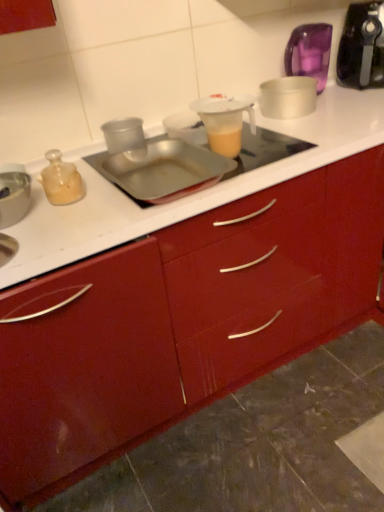
Question: From the image's perspective, relative to metallic silver bowl at left, which ranks as the 1th appliance in front-to-back order, is translucent plastic pitcher at center above or below?

Choices:
 (A) above
 (B) below

Answer: (A)

Question: Is translucent plastic pitcher at center bigger or smaller than metallic silver bowl at left, which is the 1th appliance in left-to-right order?

Choices:
 (A) big
 (B) small

Answer: (B)

Question: Considering the real-world distances, which object is farthest from the black plastic blender at upper right?

Choices:
 (A) transparent plastic cup at center, which is the third appliance in right-to-left order
 (B) translucent plastic pitcher at center
 (C) metallic silver tray at center
 (D) metallic silver bowl at left, which is the 1th appliance in left-to-right order
 (E) translucent purple container at upper right, which is counted as the fourth appliance, starting from the front

Answer: (D)

Question: Which of these objects is positioned farthest from the metallic silver tray at center?

Choices:
 (A) transparent plastic cup at center, acting as the second appliance starting from the bottom
 (B) translucent plastic pitcher at center
 (C) black plastic blender at upper right
 (D) translucent purple container at upper right, which is counted as the fourth appliance, starting from the front
 (E) metallic silver bowl at left, positioned as the 1th appliance in bottom-to-top order

Answer: (C)